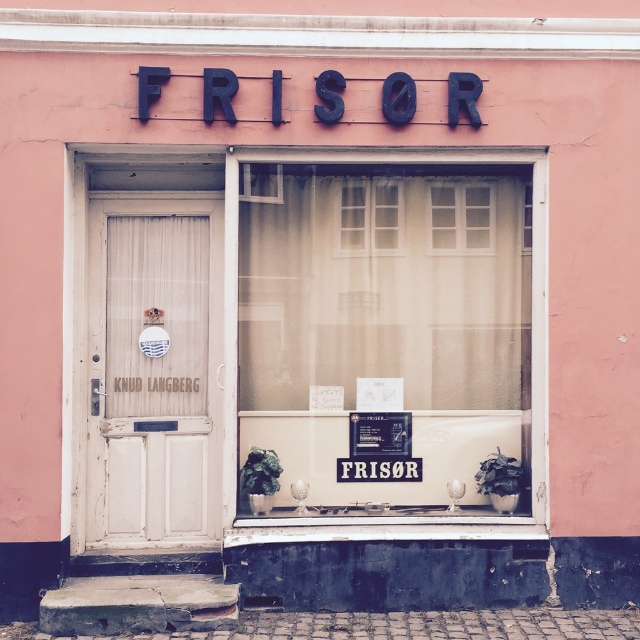
Question: Which of the following is the farthest from the observer?

Choices:
 (A) white wooden door at left
 (B) white paper at center
 (C) translucent fabric at center

Answer: (B)

Question: Can you confirm if translucent fabric at center is positioned below white wooden door at left?

Choices:
 (A) no
 (B) yes

Answer: (A)

Question: Does translucent fabric at center appear under white paper at center?

Choices:
 (A) yes
 (B) no

Answer: (B)

Question: Among these points, which one is nearest to the camera?

Choices:
 (A) (188, 344)
 (B) (506, 404)

Answer: (A)

Question: Is translucent fabric at center to the right of white paper at center from the viewer's perspective?

Choices:
 (A) no
 (B) yes

Answer: (B)

Question: Which point is farther to the camera?

Choices:
 (A) white paper at center
 (B) translucent fabric at center
 (C) white wooden door at left

Answer: (A)